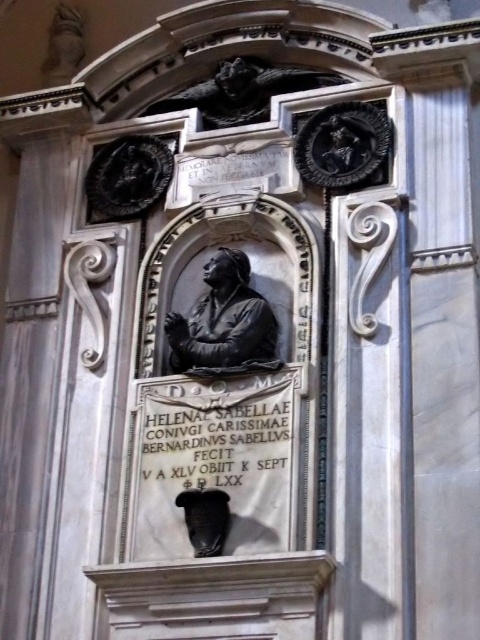
Is black stone gargoyle at upper center taller than matte black bust at lower center?

In fact, black stone gargoyle at upper center may be shorter than matte black bust at lower center.

Does black stone gargoyle at upper center lie behind matte black bust at lower center?

Yes, black stone gargoyle at upper center is behind matte black bust at lower center.

Is point (216, 100) positioned behind point (194, 529)?

Yes, it is behind point (194, 529).

Locate an element on the screen. black stone gargoyle at upper center is located at coordinates (241, 92).

Does black polished stone statue at center lie in front of black stone gargoyle at upper center?

Yes, it is.

Where is `black polished stone statue at center`? This screenshot has height=640, width=480. black polished stone statue at center is located at coordinates (223, 321).

Which is more to the right, black polished stone statue at center or matte black bust at lower center?

black polished stone statue at center is more to the right.

Does black polished stone statue at center have a smaller size compared to matte black bust at lower center?

Yes, black polished stone statue at center is smaller than matte black bust at lower center.

At what (x,y) coordinates should I click in order to perform the action: click on black polished stone statue at center. Please return your answer as a coordinate pair (x, y). Looking at the image, I should click on (223, 321).